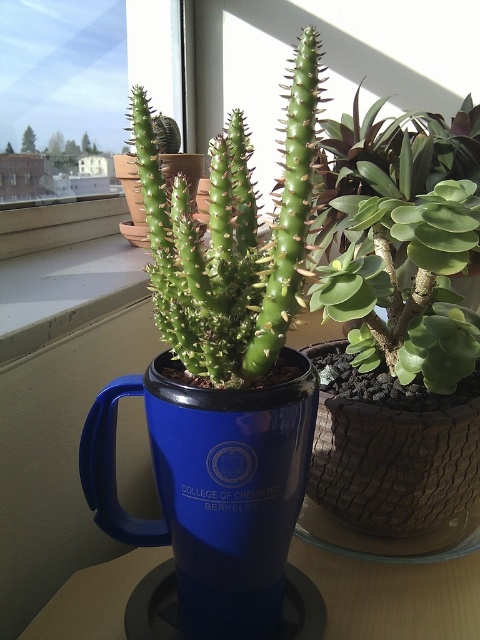
Question: Among these objects, which one is farthest from the camera?

Choices:
 (A) green succulent at center
 (B) blue plastic table at center

Answer: (B)

Question: Which object is closer to the camera taking this photo?

Choices:
 (A) green succulent at center
 (B) blue ceramic mug at center

Answer: (B)

Question: Is blue ceramic mug at center to the right of green succulent at center from the viewer's perspective?

Choices:
 (A) yes
 (B) no

Answer: (B)

Question: Estimate the real-world distances between objects in this image. Which object is farther from the blue plastic table at center?

Choices:
 (A) transparent glass window at upper center
 (B) green succulent at center
 (C) blue ceramic mug at center

Answer: (A)

Question: Is transparent glass window at upper center further to camera compared to green succulent at center?

Choices:
 (A) no
 (B) yes

Answer: (B)

Question: Is blue ceramic mug at center thinner than transparent glass window at upper center?

Choices:
 (A) yes
 (B) no

Answer: (A)